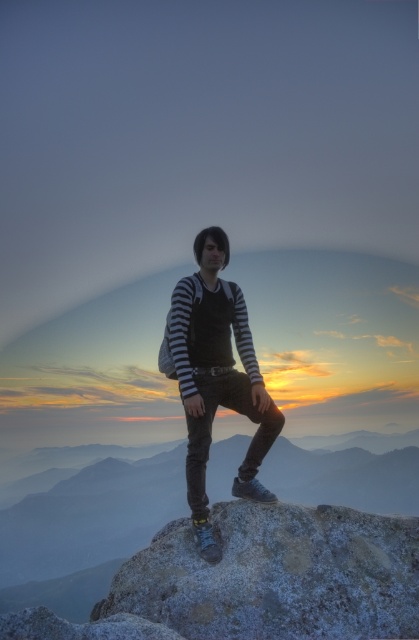
Measure the distance between frosty rock at center and camera.

frosty rock at center and camera are 4.67 meters apart from each other.

Is the position of frosty rock at center less distant than that of striped fabric shirt at center?

Yes, frosty rock at center is closer to the viewer.

From the picture: Who is more distant from viewer, (x=243, y=566) or (x=207, y=228)?

The point (x=207, y=228) is behind.

Where is `frosty rock at center`? This screenshot has height=640, width=419. frosty rock at center is located at coordinates (277, 576).